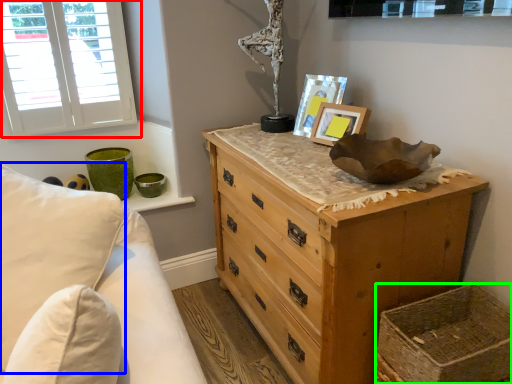
Question: Which is nearer to the window (highlighted by a red box)? pillow (highlighted by a blue box) or basket (highlighted by a green box).

Choices:
 (A) pillow
 (B) basket

Answer: (A)